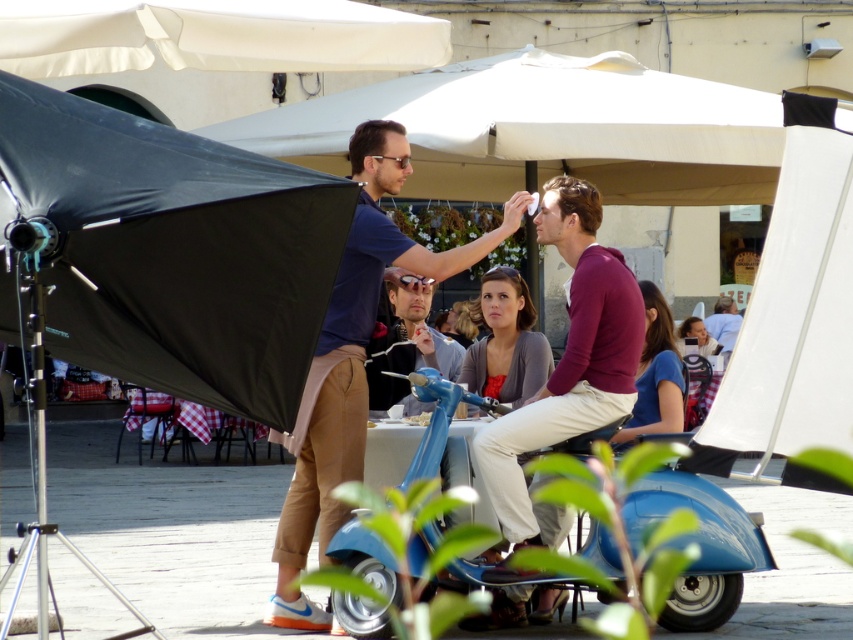
You are a delivery person who needs to quickly move a package from the blue metallic scooter at center to the matte gray sweater at center. Given that your delivery robot has a maximum reach of 1.5 meters, can it complete this task without moving its position?

The blue metallic scooter at center is 1.44 meters away from the matte gray sweater at center. Since the distance is within the robot s 1.5 meter maximum reach, the delivery robot can complete the task without moving its position.

You are planning to park your car in this outdoor area. The parking spot you want is directly behind the blue matte scooter at center. Based on the scene description, can you determine if the parking spot is currently available?

The blue matte scooter at center is located at point [352,360], so the parking spot directly behind it might be occupied or reserved for the scooter. Check for any signs or ask staff to confirm availability.